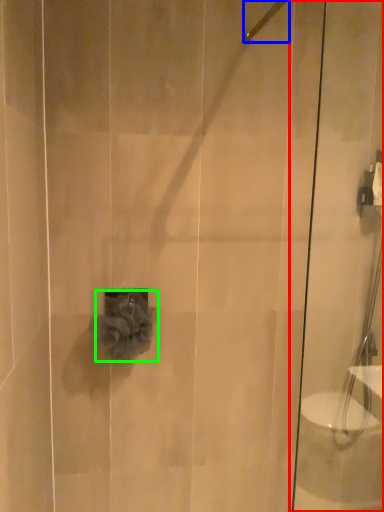
Question: Estimate the real-world distances between objects in this image. Which object is farther from shower door (highlighted by a red box), shower (highlighted by a blue box) or flower (highlighted by a green box)?

Choices:
 (A) shower
 (B) flower

Answer: (A)